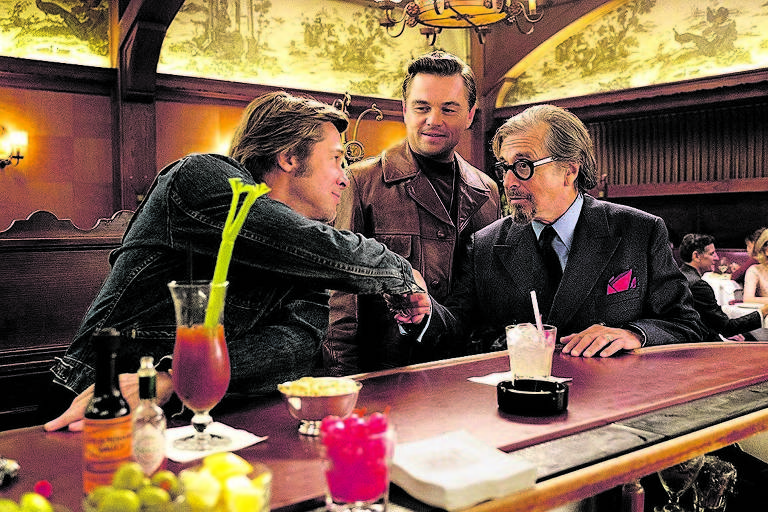
Find the location of a particular element. This screenshot has width=768, height=512. table is located at coordinates (644, 371).